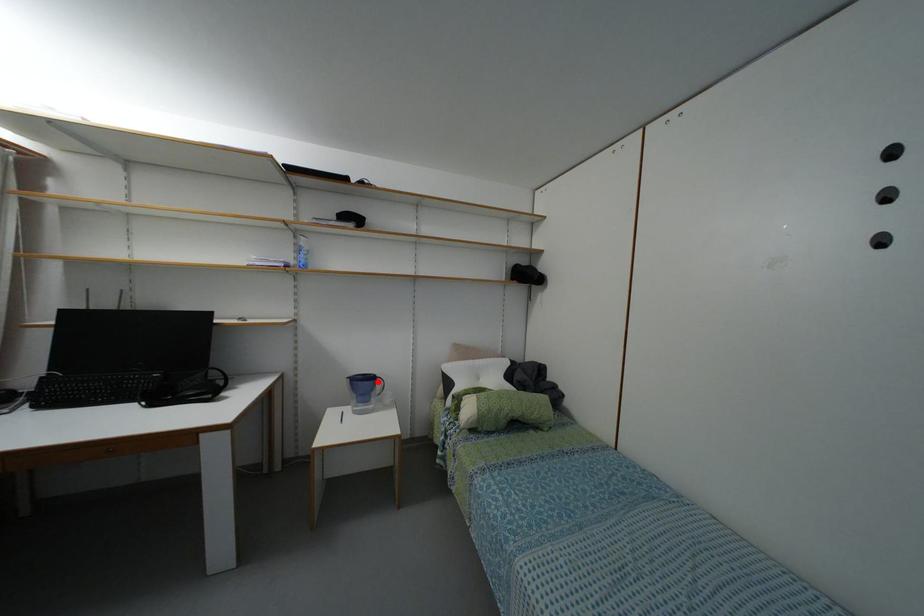
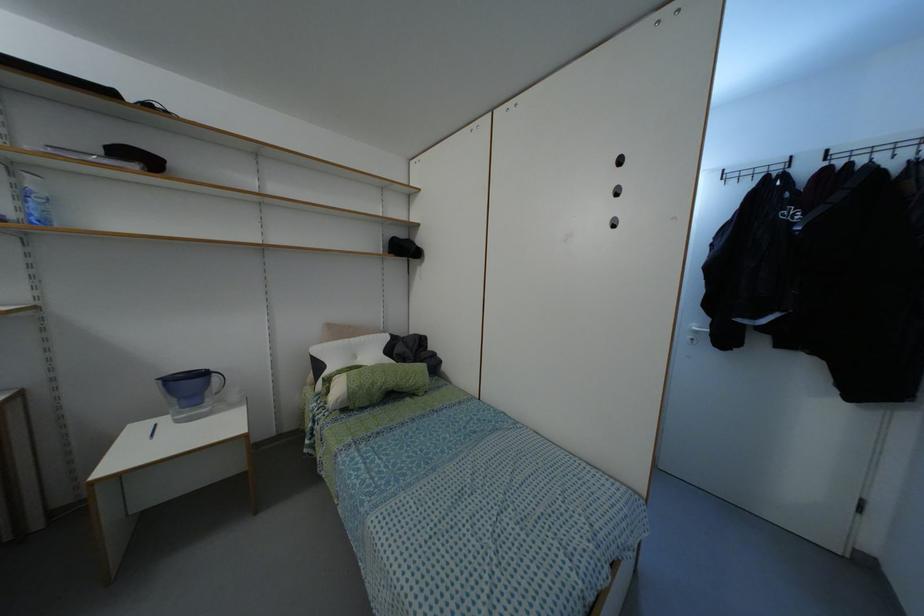
Question: I am providing you with two images of the same scene from different viewpoints. A red point is marked on the first image. At the location where the point appears in image 1, is it still visible in image 2?

Choices:
 (A) Yes
 (B) No

Answer: (A)